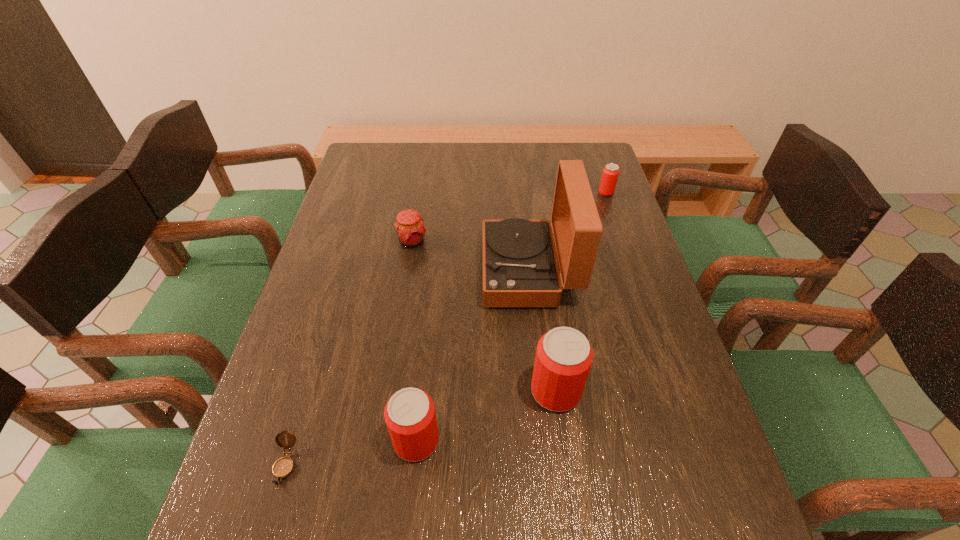
All beer cans are currently evenly spaced. To continue this pattern, where would you add another beer can on the right? Please point out a vacant spot. Please provide its 2D coordinates. Your answer should be formatted as a tuple, i.e. [(x, y)], where the tuple contains the x and y coordinates of a point satisfying the conditions above.

[(675, 348)]